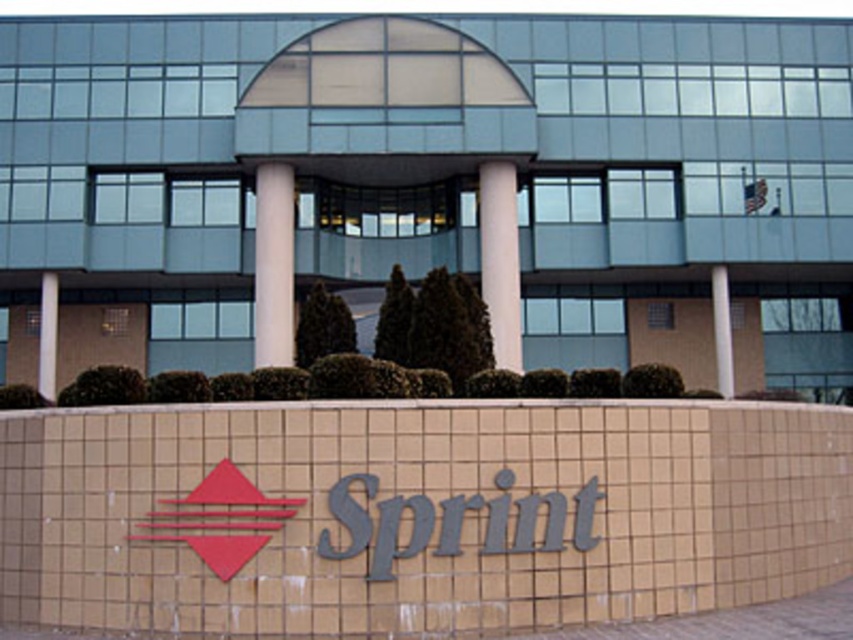
You are standing in front of the Sprint building and want to determine which of the two points, point (483, 192) or point (714, 268), is closer to you. Based on the image, which point is nearer?

Point (483, 192) is closer to the viewer than point (714, 268).